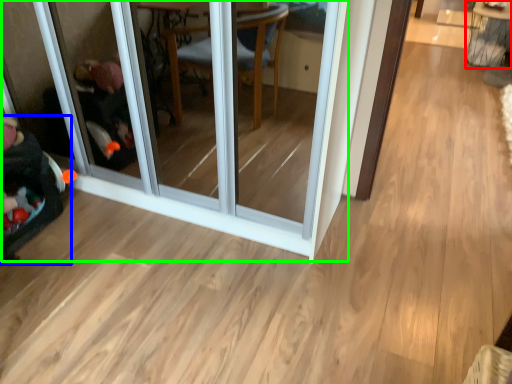
Question: Based on their relative distances, which object is farther from table (highlighted by a red box)? Choose from baby carriage (highlighted by a blue box) and screen door (highlighted by a green box).

Choices:
 (A) baby carriage
 (B) screen door

Answer: (A)